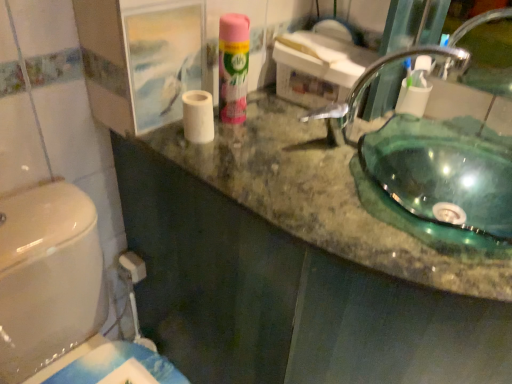
I want to click on vacant area that is in front of transparent glass sink at upper right, so click(x=374, y=213).